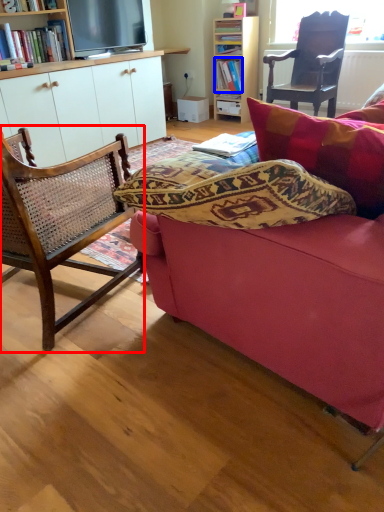
Question: Among these objects, which one is nearest to the camera, chair (highlighted by a red box) or book (highlighted by a blue box)?

Choices:
 (A) chair
 (B) book

Answer: (A)